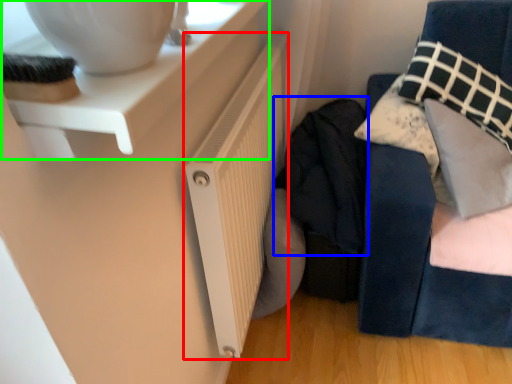
Question: Which is farther away from radiator (highlighted by a red box)? clothing (highlighted by a blue box) or table (highlighted by a green box)?

Choices:
 (A) clothing
 (B) table

Answer: (B)